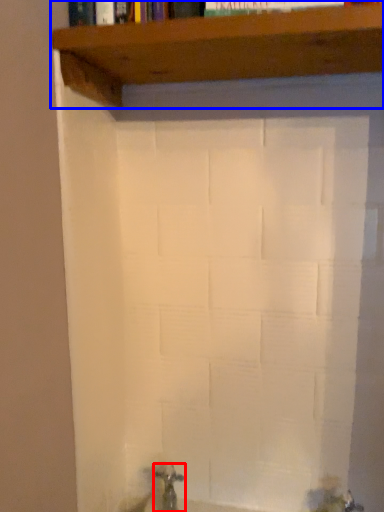
Question: Among these objects, which one is nearest to the camera, tap (highlighted by a red box) or shelf (highlighted by a blue box)?

Choices:
 (A) tap
 (B) shelf

Answer: (B)